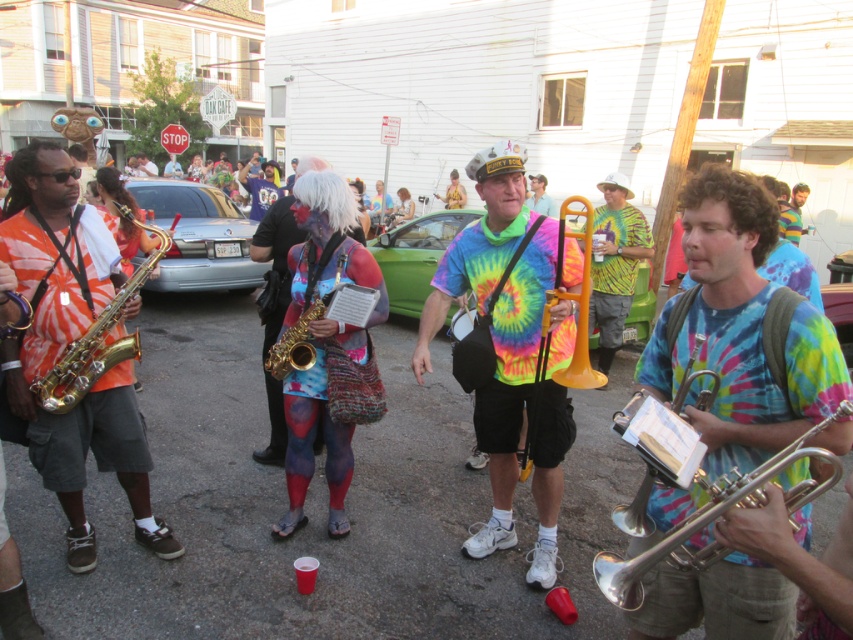
Question: Can you confirm if matte yellow tuba at center is thinner than gold brass trumpet at left?

Choices:
 (A) yes
 (B) no

Answer: (B)

Question: Does silver metallic trumpet at right lie in front of matte yellow tuba at center?

Choices:
 (A) yes
 (B) no

Answer: (A)

Question: Which point is closer to the camera?

Choices:
 (A) pos(604,292)
 (B) pos(714,276)
 (C) pos(647,474)
 (D) pos(44,392)

Answer: (B)

Question: Estimate the real-world distances between objects in this image. Which object is closer to the shiny silver trumpet at center?

Choices:
 (A) matte yellow tuba at center
 (B) silver metallic trumpet at right
 (C) gold brass trumpet at left

Answer: (B)

Question: Among these points, which one is farthest from the camera?

Choices:
 (A) (612, 509)
 (B) (840, 428)
 (C) (82, 349)

Answer: (A)

Question: Observing the image, what is the correct spatial positioning of body paint saxophone at center in reference to silver metallic trumpet at center-right?

Choices:
 (A) above
 (B) below

Answer: (A)